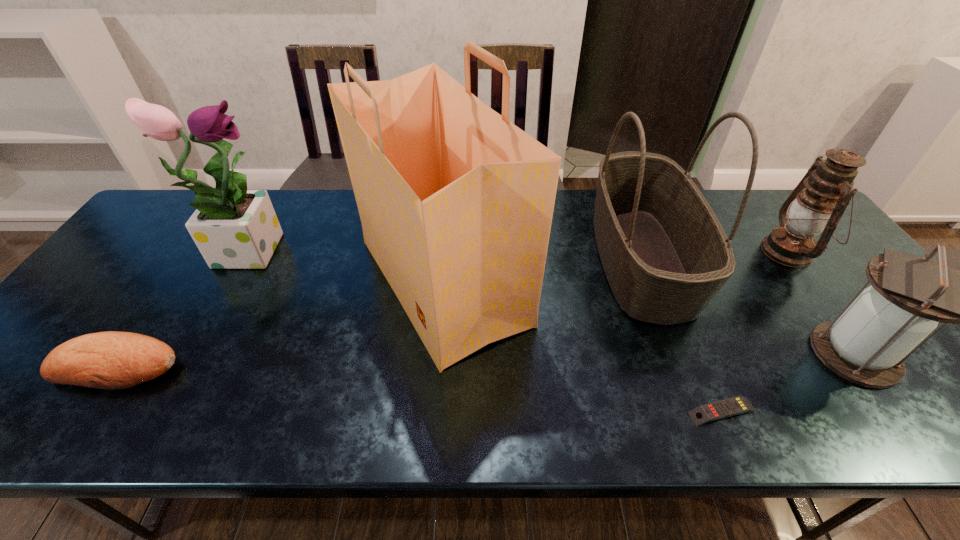
The image size is (960, 540). I want to click on free region that satisfies the following two spatial constraints: 1. on the back side of the basket; 2. on the front-facing side of the flower arrangement, so [636, 247].

Find the location of `free space that satisfies the following two spatial constraints: 1. on the front-facing side of the flower arrangement; 2. on the back side of the basket`. free space that satisfies the following two spatial constraints: 1. on the front-facing side of the flower arrangement; 2. on the back side of the basket is located at coordinates (241, 259).

Identify the location of vacant point that satisfies the following two spatial constraints: 1. on the side of the tallest object with the superhero design; 2. on the left side of the lantern. This screenshot has height=540, width=960. (437, 354).

This screenshot has width=960, height=540. Identify the location of free space that satisfies the following two spatial constraints: 1. on the front-facing side of the lantern; 2. on the left side of the flower arrangement. (245, 252).

Image resolution: width=960 pixels, height=540 pixels. I want to click on free space that satisfies the following two spatial constraints: 1. on the front-facing side of the flower arrangement; 2. on the left side of the basket, so click(x=241, y=259).